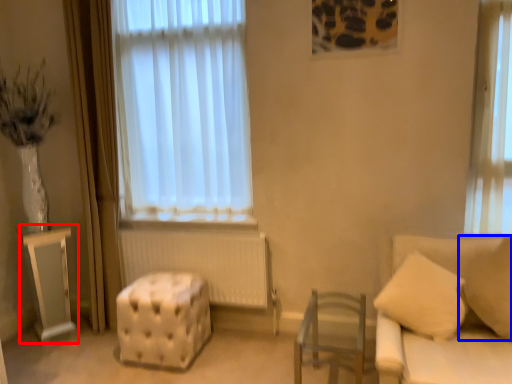
Question: Which object is further to the camera taking this photo, table (highlighted by a red box) or pillow (highlighted by a blue box)?

Choices:
 (A) table
 (B) pillow

Answer: (A)